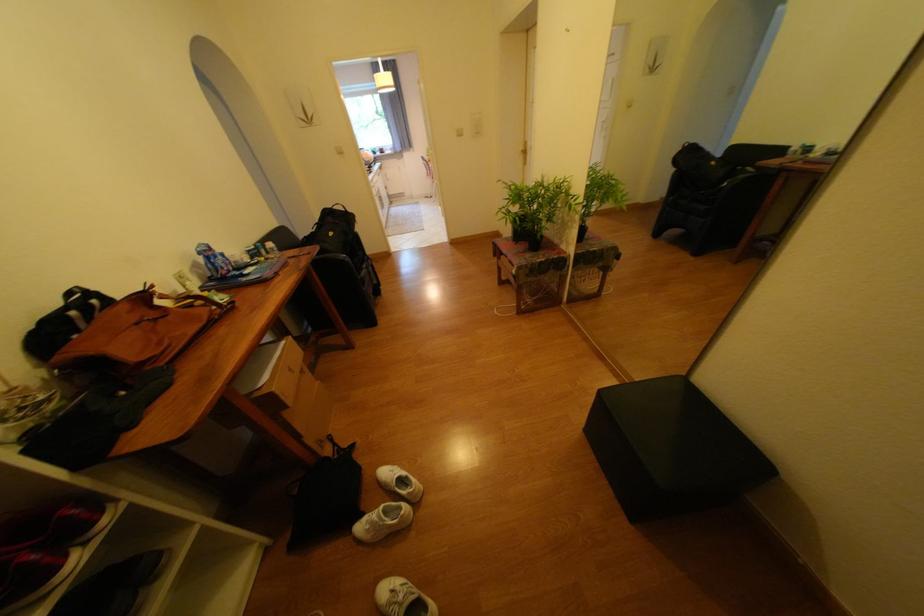
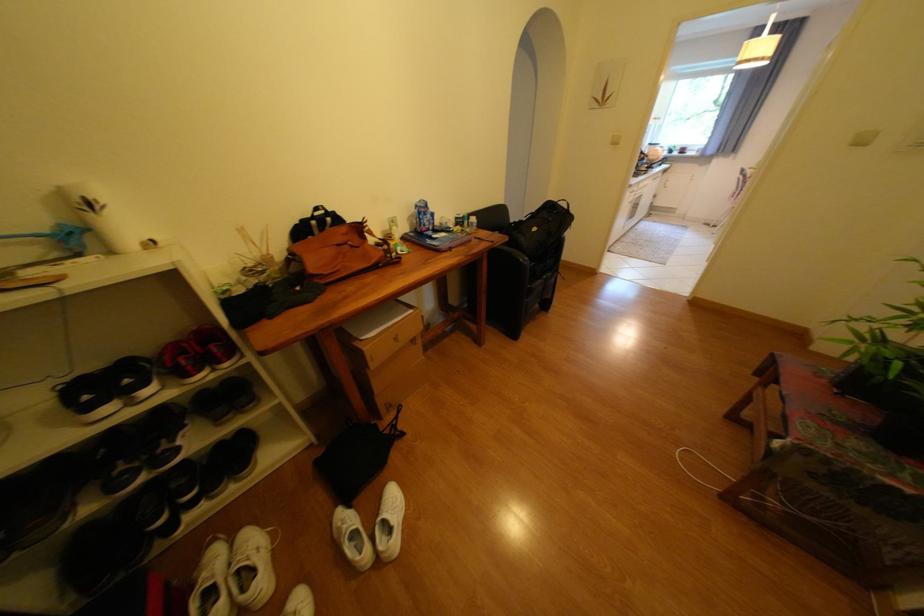
The point at [369,543] is marked in the first image. Where is the corresponding point in the second image?

(342, 524)